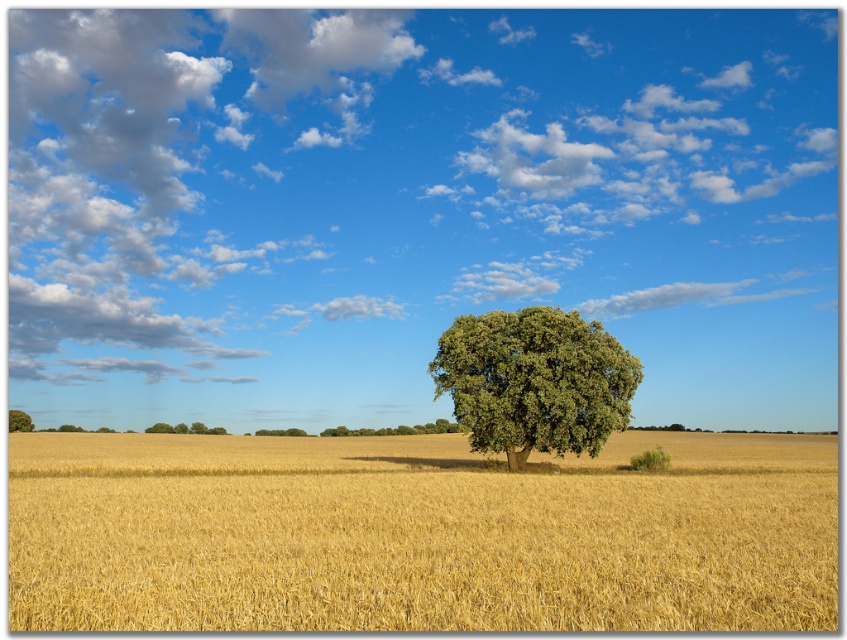
Who is higher up, golden matte wheat field at center or green leafy tree at left?

golden matte wheat field at center is above.

Does golden matte wheat field at center have a greater width compared to green leafy tree at left?

Indeed, golden matte wheat field at center has a greater width compared to green leafy tree at left.

Between point (792, 628) and point (23, 419), which one is positioned in front?

Point (792, 628)

Where is `golden matte wheat field at center`? golden matte wheat field at center is located at coordinates (418, 536).

Who is lower down, white fluffy cloud at upper center or green leafy tree at center?

Positioned lower is green leafy tree at center.

I want to click on white fluffy cloud at upper center, so click(397, 177).

Is point (136, 289) farther from viewer compared to point (502, 323)?

That is True.

Locate an element on the screen. The image size is (847, 640). white fluffy cloud at upper center is located at coordinates (397, 177).

Which is more to the left, green leafy tree at center or green leafy tree at left?

From the viewer's perspective, green leafy tree at left appears more on the left side.

Consider the image. Does green leafy tree at center have a larger size compared to green leafy tree at left?

Yes.

Which is in front, point (491, 394) or point (25, 419)?

Point (491, 394)

This screenshot has width=847, height=640. I want to click on green leafy tree at center, so [x=534, y=381].